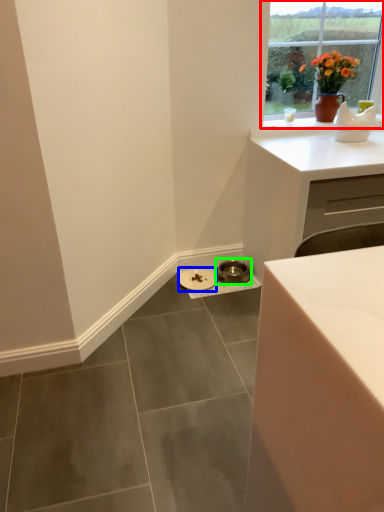
Question: Which object is positioned closest to window (highlighted by a red box)? Select from manhole cover (highlighted by a blue box) and manhole cover (highlighted by a green box).

Choices:
 (A) manhole cover
 (B) manhole cover

Answer: (B)